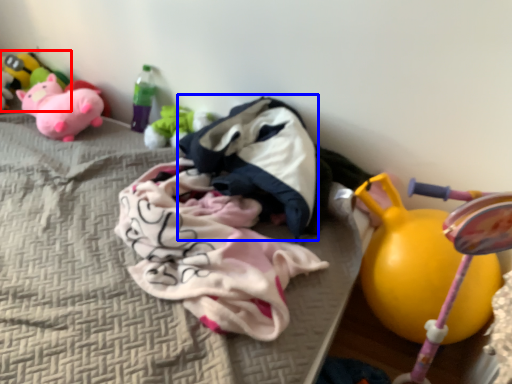
Question: Which of the following is the closest to the observer, toy (highlighted by a red box) or clothing (highlighted by a blue box)?

Choices:
 (A) toy
 (B) clothing

Answer: (B)